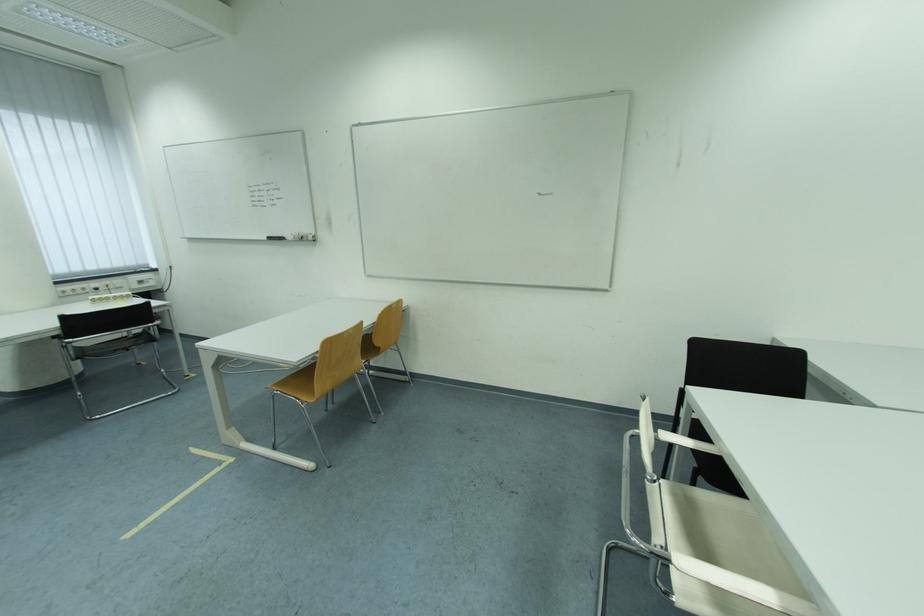
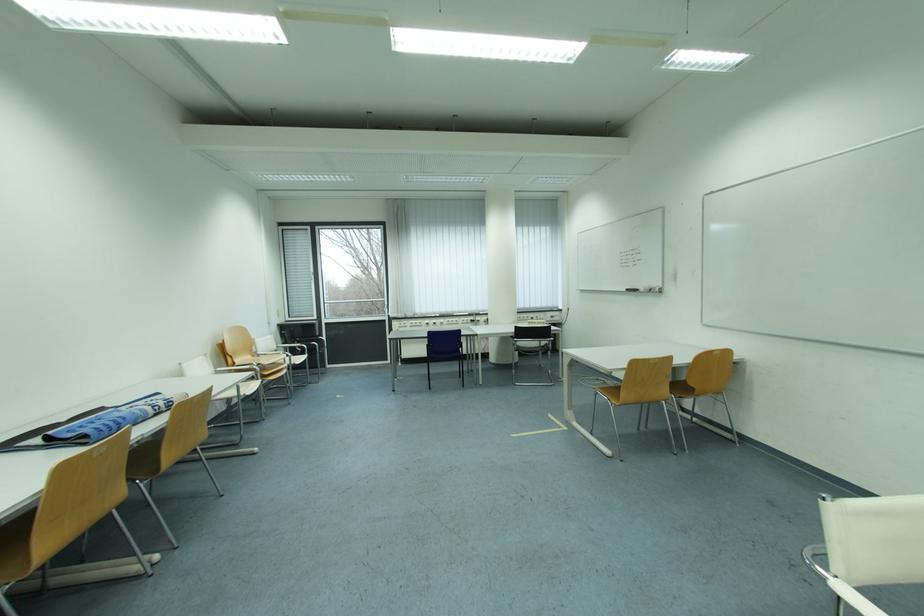
Question: The camera is either moving clockwise (left) or counter-clockwise (right) around the object. The first image is from the beginning of the video and the second image is from the end. Is the camera moving left or right when shooting the video?

Choices:
 (A) Left
 (B) Right

Answer: (B)